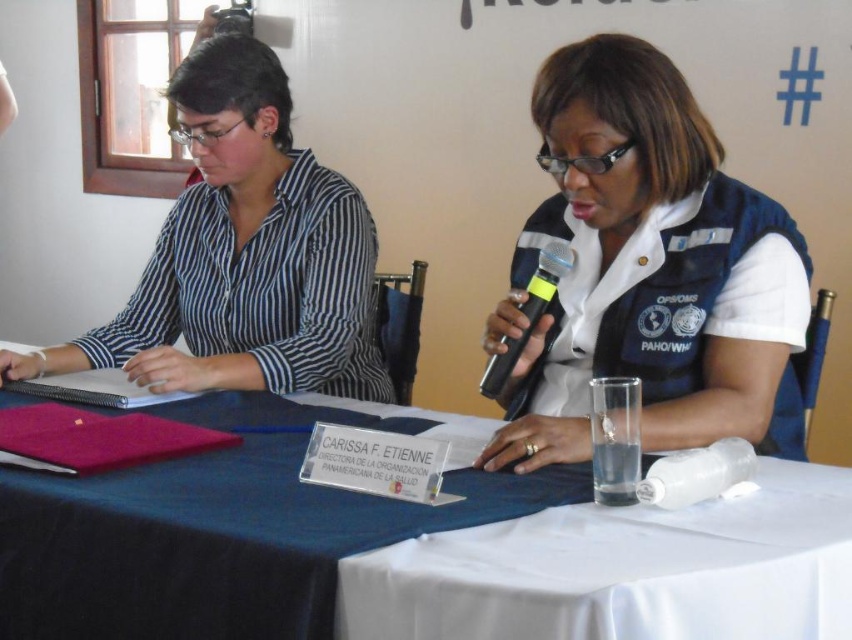
Question: Based on their relative distances, which object is farther from the white cloth at center?

Choices:
 (A) matte black shirt at left
 (B) white matte vest at center
 (C) black plastic microphone at center

Answer: (A)

Question: Does white cloth at center come behind matte black shirt at left?

Choices:
 (A) no
 (B) yes

Answer: (A)

Question: Can you confirm if white matte vest at center is wider than white cloth at center?

Choices:
 (A) no
 (B) yes

Answer: (A)

Question: Which point appears closest to the camera in this image?

Choices:
 (A) (263, 417)
 (B) (735, 384)
 (C) (242, 134)

Answer: (B)

Question: Is matte black shirt at left positioned at the back of black plastic microphone at center?

Choices:
 (A) yes
 (B) no

Answer: (A)

Question: Which object is the closest to the matte black shirt at left?

Choices:
 (A) black plastic microphone at center
 (B) white cloth at center

Answer: (B)